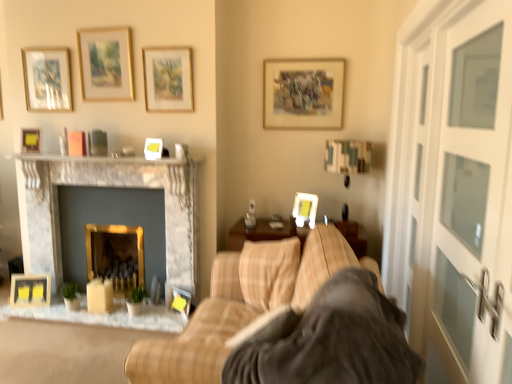
Question: Is the position of matte black picture frame at lower center, which is counted as the 3th picture frame, starting from the right, less distant than that of marble fireplace at center, which appears as the 1th fireplace when viewed from the left?

Choices:
 (A) no
 (B) yes

Answer: (A)

Question: From a real-world perspective, is matte black picture frame at lower center, which is counted as the 3th picture frame, starting from the right, below marble fireplace at center, which is counted as the second fireplace, starting from the right?

Choices:
 (A) no
 (B) yes

Answer: (B)

Question: Can you confirm if matte black picture frame at lower center, which is counted as the 3th picture frame, starting from the right, is taller than marble fireplace at center, which appears as the 1th fireplace when viewed from the left?

Choices:
 (A) no
 (B) yes

Answer: (A)

Question: Does matte black picture frame at lower center, the 8th picture frame positioned from the left, have a lesser width compared to marble fireplace at center, which is counted as the second fireplace, starting from the right?

Choices:
 (A) yes
 (B) no

Answer: (A)

Question: Does matte black picture frame at lower center, which is counted as the 3th picture frame, starting from the right, have a smaller size compared to marble fireplace at center, which is counted as the second fireplace, starting from the right?

Choices:
 (A) yes
 (B) no

Answer: (A)

Question: Considering the positions of point (173, 61) and point (250, 345), is point (173, 61) closer or farther from the camera than point (250, 345)?

Choices:
 (A) closer
 (B) farther

Answer: (B)

Question: In the image, is matte gold picture frame at upper center, the 4th picture frame positioned from the right, on the left side or the right side of soft gray blanket at center?

Choices:
 (A) right
 (B) left

Answer: (B)

Question: From a real-world perspective, is matte gold picture frame at upper center, which is the 7th picture frame from left to right, positioned above or below soft gray blanket at center?

Choices:
 (A) below
 (B) above

Answer: (B)

Question: Which is correct: matte gold picture frame at upper center, the 4th picture frame positioned from the right, is inside soft gray blanket at center, or outside of it?

Choices:
 (A) outside
 (B) inside

Answer: (A)

Question: Is marble fireplace at center, which is counted as the second fireplace, starting from the right, wider or thinner than matte glass picture frame at upper left, arranged as the third picture frame when viewed from the left?

Choices:
 (A) thin
 (B) wide

Answer: (B)

Question: In the image, is marble fireplace at center, which is counted as the second fireplace, starting from the right, on the left side or the right side of matte glass picture frame at upper left, the 8th picture frame when ordered from right to left?

Choices:
 (A) left
 (B) right

Answer: (B)

Question: Which is correct: marble fireplace at center, which appears as the 1th fireplace when viewed from the left, is inside matte glass picture frame at upper left, arranged as the third picture frame when viewed from the left, or outside of it?

Choices:
 (A) inside
 (B) outside

Answer: (B)

Question: From a real-world perspective, is marble fireplace at center, which appears as the 1th fireplace when viewed from the left, positioned above or below matte glass picture frame at upper left, the 8th picture frame when ordered from right to left?

Choices:
 (A) below
 (B) above

Answer: (A)

Question: Visually, is wooden picture frame at upper center, which is the second picture frame from right to left, positioned to the left or to the right of matte black picture frame at lower center, the 8th picture frame positioned from the left?

Choices:
 (A) right
 (B) left

Answer: (A)

Question: Choose the correct answer: Is wooden picture frame at upper center, marked as the ninth picture frame in a left-to-right arrangement, inside matte black picture frame at lower center, which is counted as the 3th picture frame, starting from the right, or outside it?

Choices:
 (A) outside
 (B) inside

Answer: (A)